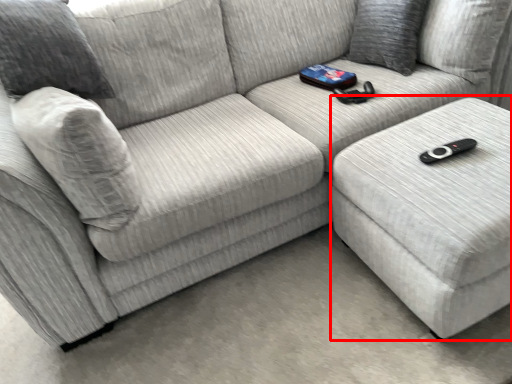
Question: Observing the image, what is the correct spatial positioning of table (annotated by the red box) in reference to pillow?

Choices:
 (A) left
 (B) right

Answer: (B)